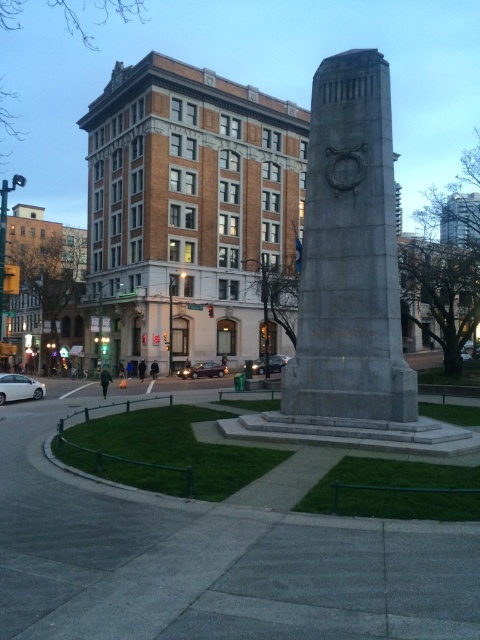
Does metallic maroon sedan at center appear under shiny silver sedan at center?

Correct, metallic maroon sedan at center is located below shiny silver sedan at center.

Who is higher up, metallic maroon sedan at center or shiny silver sedan at center?

shiny silver sedan at center is above.

What do you see at coordinates (203, 371) in the screenshot? The height and width of the screenshot is (640, 480). I see `metallic maroon sedan at center` at bounding box center [203, 371].

Where is `metallic maroon sedan at center`? The image size is (480, 640). metallic maroon sedan at center is located at coordinates tap(203, 371).

Which is in front, point (17, 374) or point (207, 369)?

Point (17, 374) is in front.

Is white matte car at lower left thinner than metallic maroon sedan at center?

No.

Does point (0, 403) come closer to viewer compared to point (194, 374)?

That is True.

I want to click on white matte car at lower left, so click(x=19, y=387).

Between gray stone monument at center and white matte car at lower left, which one has more height?

gray stone monument at center

Is point (313, 364) farther from camera compared to point (23, 397)?

No, it is in front of (23, 397).

The width and height of the screenshot is (480, 640). Identify the location of gray stone monument at center. (349, 253).